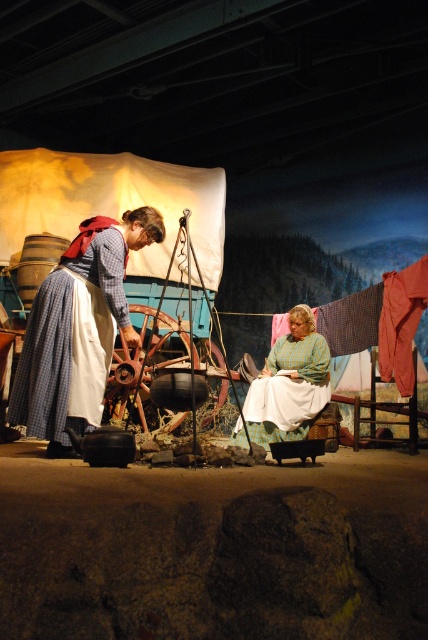
Looking at this image, is blue plaid dress at left thinner than green plaid dress at center?

Indeed, blue plaid dress at left has a lesser width compared to green plaid dress at center.

Can you confirm if blue plaid dress at left is shorter than green plaid dress at center?

No.

Who is more distant from viewer, (44, 358) or (300, 371)?

The point (300, 371) is behind.

Where is `blue plaid dress at left`? blue plaid dress at left is located at coordinates (44, 362).